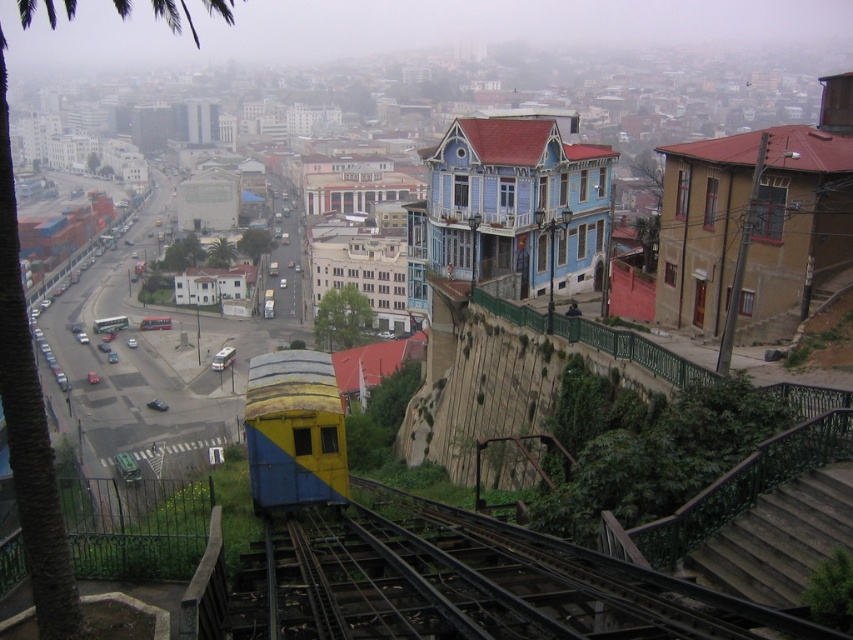
Question: Among these objects, which one is farthest from the camera?

Choices:
 (A) yellow matte train at center
 (B) green leafy palm tree at left

Answer: (A)

Question: Does green leafy palm tree at left have a larger size compared to yellow matte train at center?

Choices:
 (A) no
 (B) yes

Answer: (B)

Question: Among these objects, which one is nearest to the camera?

Choices:
 (A) green leafy palm tree at left
 (B) yellow matte train at center

Answer: (A)

Question: Does green leafy palm tree at left appear on the right side of yellow matte train at center?

Choices:
 (A) yes
 (B) no

Answer: (B)

Question: Can you confirm if green leafy palm tree at left is positioned to the right of yellow matte train at center?

Choices:
 (A) yes
 (B) no

Answer: (B)

Question: Which point is closer to the camera taking this photo?

Choices:
 (A) (x=62, y=557)
 (B) (x=277, y=468)

Answer: (A)